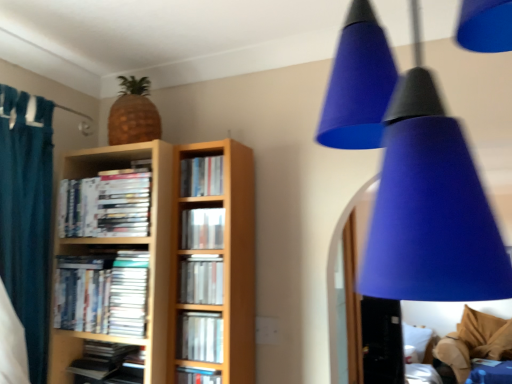
Question: Is matte silver book at center, positioned as the third book in bottom-to-top order, not near matte silver book at center, positioned as the fourth book in top-to-bottom order?

Choices:
 (A) yes
 (B) no

Answer: (B)

Question: Considering the relative sizes of matte silver book at center, which is the sixth book in top-to-bottom order, and matte silver book at center, positioned as the fourth book in top-to-bottom order, in the image provided, is matte silver book at center, which is the sixth book in top-to-bottom order, shorter than matte silver book at center, positioned as the fourth book in top-to-bottom order,?

Choices:
 (A) no
 (B) yes

Answer: (B)

Question: Can you confirm if matte silver book at center, positioned as the third book in bottom-to-top order, is taller than matte silver book at center, which ranks as the 5th book in bottom-to-top order?

Choices:
 (A) yes
 (B) no

Answer: (B)

Question: Can you see matte silver book at center, positioned as the third book in bottom-to-top order, touching matte silver book at center, which ranks as the 5th book in bottom-to-top order?

Choices:
 (A) no
 (B) yes

Answer: (A)

Question: Does matte silver book at center, which is the sixth book in top-to-bottom order, lie in front of matte silver book at center, which ranks as the 5th book in bottom-to-top order?

Choices:
 (A) no
 (B) yes

Answer: (B)

Question: Considering the positions of matte plastic book at center, which appears as the sixth book when ordered from the bottom, and matte plastic books at center left, which appears as the fifth book when viewed from the top, in the image, is matte plastic book at center, which appears as the sixth book when ordered from the bottom, taller or shorter than matte plastic books at center left, which appears as the fifth book when viewed from the top,?

Choices:
 (A) tall
 (B) short

Answer: (B)

Question: Choose the correct answer: Is matte plastic book at center, which appears as the sixth book when ordered from the bottom, inside matte plastic books at center left, which appears as the fifth book when viewed from the top, or outside it?

Choices:
 (A) inside
 (B) outside

Answer: (B)

Question: Based on their sizes in the image, would you say matte plastic book at center, the 3th book when ordered from top to bottom, is bigger or smaller than matte plastic books at center left, which appears as the fifth book when viewed from the top?

Choices:
 (A) small
 (B) big

Answer: (A)

Question: In the image, is matte plastic book at center, which appears as the sixth book when ordered from the bottom, positioned in front of or behind matte plastic books at center left, the fourth book in the bottom-to-top sequence?

Choices:
 (A) front
 (B) behind

Answer: (A)

Question: From a real-world perspective, is hardcover books at center, the first book when ordered from top to bottom, above or below matte silver book at center, which is the sixth book in top-to-bottom order?

Choices:
 (A) below
 (B) above

Answer: (B)

Question: From the image's perspective, is hardcover books at center, the first book when ordered from top to bottom, located above or below matte silver book at center, which is the sixth book in top-to-bottom order?

Choices:
 (A) above
 (B) below

Answer: (A)

Question: Choose the correct answer: Is hardcover books at center, which is the 8th book in bottom-to-top order, inside matte silver book at center, which is the sixth book in top-to-bottom order, or outside it?

Choices:
 (A) outside
 (B) inside

Answer: (A)

Question: Considering the relative positions of hardcover books at center, which is the 8th book in bottom-to-top order, and matte silver book at center, which is the sixth book in top-to-bottom order, in the image provided, is hardcover books at center, which is the 8th book in bottom-to-top order, to the left or to the right of matte silver book at center, which is the sixth book in top-to-bottom order,?

Choices:
 (A) left
 (B) right

Answer: (A)

Question: Do you think white paper at center is within hardcover books at center, the first book when ordered from top to bottom, or outside of it?

Choices:
 (A) inside
 (B) outside

Answer: (B)

Question: From a real-world perspective, relative to hardcover books at center, which is the 8th book in bottom-to-top order, is white paper at center vertically above or below?

Choices:
 (A) above
 (B) below

Answer: (B)